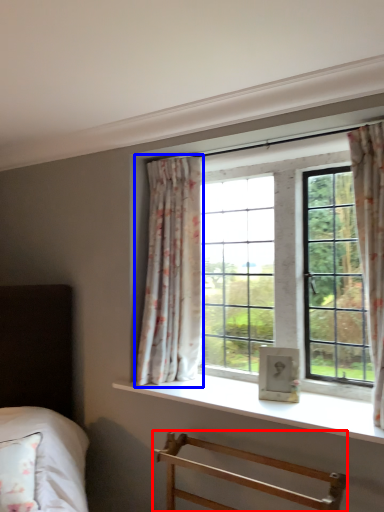
Question: Which object is closer to the camera taking this photo, furniture (highlighted by a red box) or curtain (highlighted by a blue box)?

Choices:
 (A) furniture
 (B) curtain

Answer: (A)